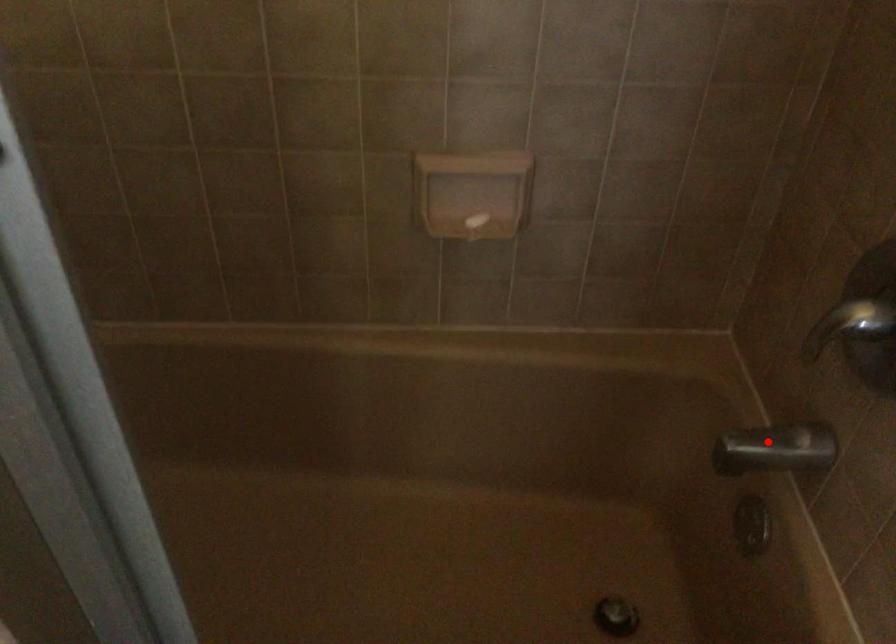
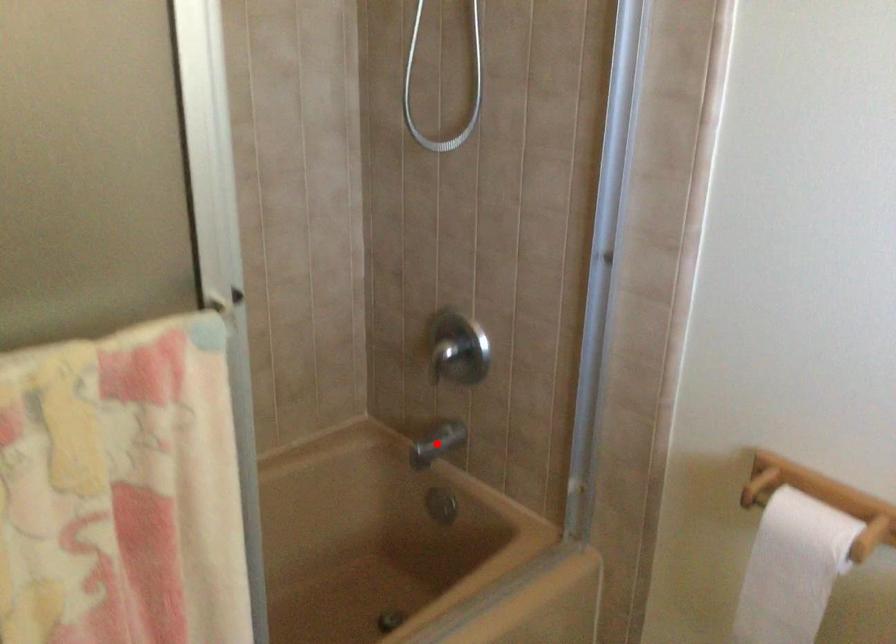
I am providing you with two images of the same scene from different viewpoints. A red point is marked on the first image and another point is marked on the second image. Do the highlighted points in image1 and image2 indicate the same real-world spot?

Yes